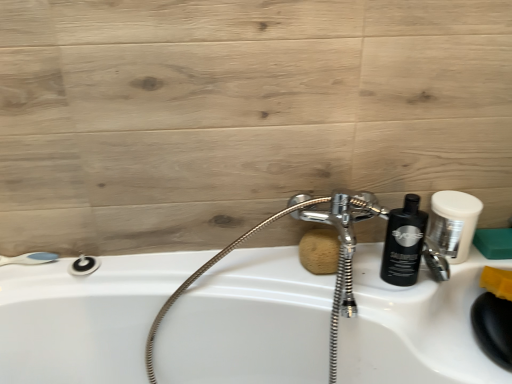
Question: Is brown sponge at center, which appears as the 1th soap when viewed from the left, bigger than matte black shower at lower left, arranged as the first shower when viewed from the right?

Choices:
 (A) no
 (B) yes

Answer: (B)

Question: Does brown sponge at center, which appears as the 1th soap when viewed from the left, have a greater width compared to matte black shower at lower left, arranged as the first shower when viewed from the right?

Choices:
 (A) no
 (B) yes

Answer: (B)

Question: Is brown sponge at center, arranged as the second soap when viewed from the right, further to the viewer compared to matte black shower at lower left, arranged as the first shower when viewed from the right?

Choices:
 (A) yes
 (B) no

Answer: (B)

Question: From the image's perspective, is brown sponge at center, which appears as the 1th soap when viewed from the left, over matte black shower at lower left, the second shower when ordered from left to right?

Choices:
 (A) no
 (B) yes

Answer: (B)

Question: Can you confirm if brown sponge at center, which appears as the 1th soap when viewed from the left, is positioned to the right of matte black shower at lower left, arranged as the first shower when viewed from the right?

Choices:
 (A) no
 (B) yes

Answer: (B)

Question: Is brown sponge at center, which appears as the 1th soap when viewed from the left, surrounding matte black shower at lower left, the second shower when ordered from left to right?

Choices:
 (A) no
 (B) yes

Answer: (A)

Question: From a real-world perspective, is white matte shaving cream at upper right over black glossy bottle at right?

Choices:
 (A) no
 (B) yes

Answer: (B)

Question: Considering the relative sizes of white matte shaving cream at upper right and black glossy bottle at right in the image provided, is white matte shaving cream at upper right smaller than black glossy bottle at right?

Choices:
 (A) no
 (B) yes

Answer: (B)

Question: Would you say white matte shaving cream at upper right is outside black glossy bottle at right?

Choices:
 (A) no
 (B) yes

Answer: (B)

Question: Is white matte shaving cream at upper right closer to the viewer compared to black glossy bottle at right?

Choices:
 (A) no
 (B) yes

Answer: (B)

Question: Is black glossy bottle at right inside white matte shaving cream at upper right?

Choices:
 (A) yes
 (B) no

Answer: (B)

Question: Can you confirm if white matte shaving cream at upper right is bigger than black glossy bottle at right?

Choices:
 (A) yes
 (B) no

Answer: (B)

Question: From a real-world perspective, does green sponge at right, marked as the 1th soap in a right-to-left arrangement, sit lower than white matte shaving cream at upper right?

Choices:
 (A) no
 (B) yes

Answer: (B)